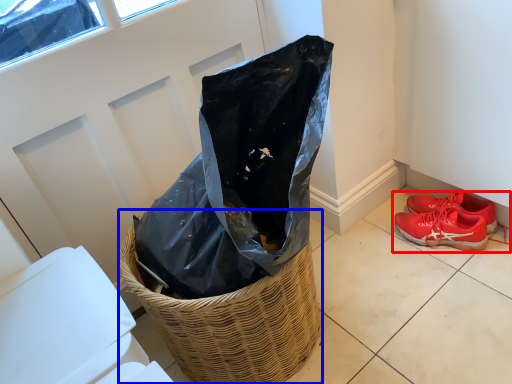
Question: Which of the following is the closest to the observer, footwear (highlighted by a red box) or basket (highlighted by a blue box)?

Choices:
 (A) footwear
 (B) basket

Answer: (B)